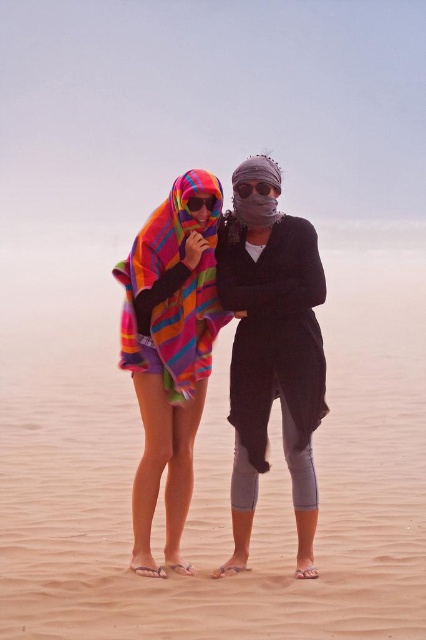
Who is taller, multicolored woven towel at center or multicolored fabric goggles at center?

With more height is multicolored woven towel at center.

At what (x,y) coordinates should I click in order to perform the action: click on multicolored woven towel at center. Please return your answer as a coordinate pair (x, y). The image size is (426, 640). Looking at the image, I should click on (215, 339).

Is point (305, 273) positioned behind point (190, 208)?

Yes, point (305, 273) is behind point (190, 208).

Where is `multicolored woven towel at center`? Image resolution: width=426 pixels, height=640 pixels. multicolored woven towel at center is located at coordinates (215, 339).

Can you confirm if multicolored woven blanket at center is thinner than matte black goggles at center?

Incorrect, multicolored woven blanket at center's width is not less than matte black goggles at center's.

What do you see at coordinates (175, 291) in the screenshot? The image size is (426, 640). I see `multicolored woven blanket at center` at bounding box center [175, 291].

Between point (181, 189) and point (253, 188), which one is positioned behind?

The point (253, 188) is behind.

Where is `multicolored woven blanket at center`? Image resolution: width=426 pixels, height=640 pixels. multicolored woven blanket at center is located at coordinates click(175, 291).

Does matte black goggles at center appear on the right side of multicolored fabric goggles at center?

Yes, matte black goggles at center is to the right of multicolored fabric goggles at center.

Does point (253, 180) come behind point (203, 195)?

No, (253, 180) is in front of (203, 195).

Locate an element on the screen. This screenshot has width=426, height=640. matte black goggles at center is located at coordinates (255, 188).